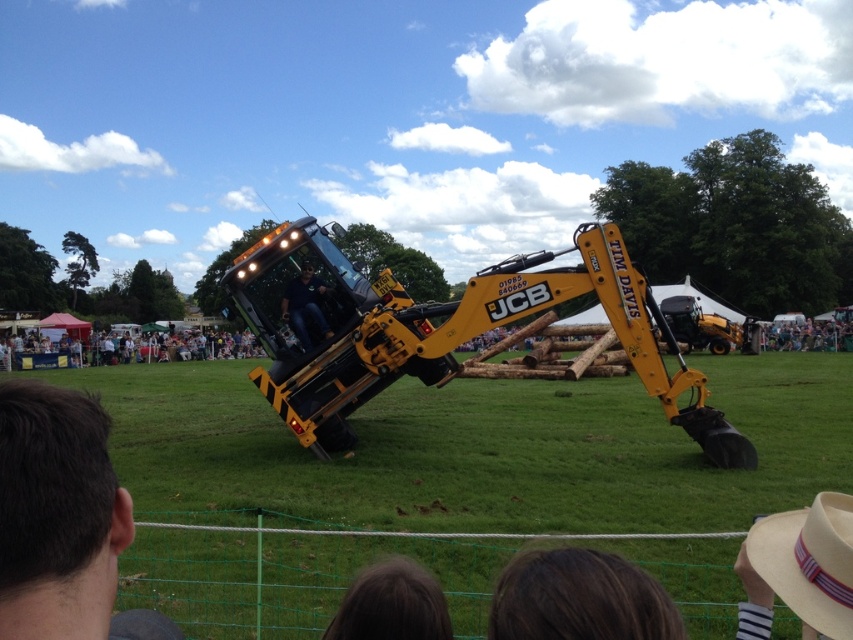
You are a photographer at the fair and want to capture both the green grass at center and the dark brown hair at lower center in a single shot. Which object would occupy more space in the photo?

The green grass at center is larger in size than the dark brown hair at lower center, so it would occupy more space in the photo.

You are a photographer at the event and want to capture a photo that includes both the dark brown hair at lower center and the dark blue jeans at center. Given that your camera has a maximum focus range of 15 meters, will you be able to include both subjects in the same frame without moving the camera?

The distance between the dark brown hair at lower center and dark blue jeans at center is 14.23 meters, which is within the camera maximum focus range of 15 meters. Therefore, you can include both subjects in the same frame without moving the camera.